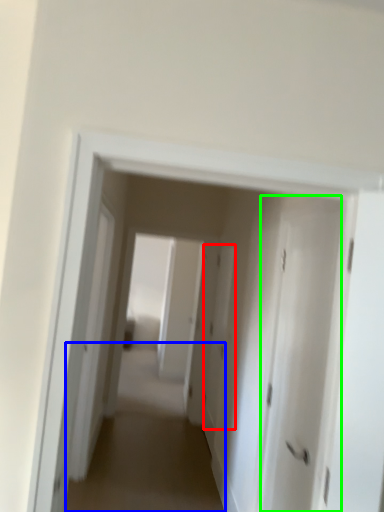
Question: Which object is positioned closest to door (highlighted by a red box)? Select from alley (highlighted by a blue box) and door (highlighted by a green box).

Choices:
 (A) alley
 (B) door

Answer: (A)